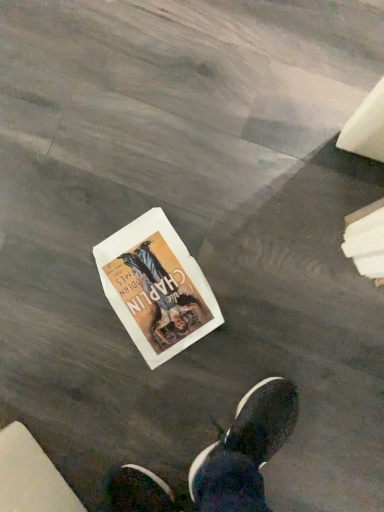
In order to click on unoccupied area behind white paper at center in this screenshot , I will do `click(86, 190)`.